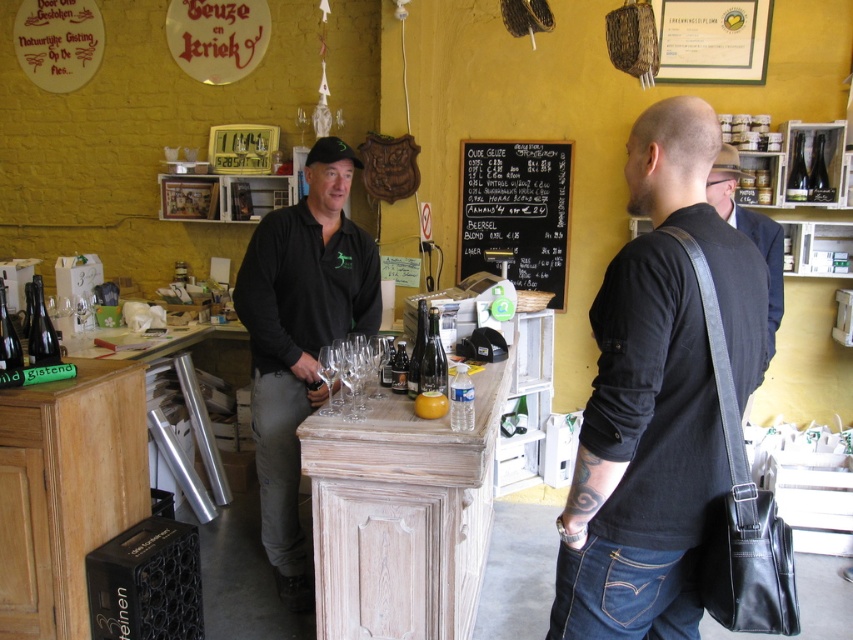
Question: Can you confirm if clear glass wine glass at center is smaller than translucent glass bottle at center?

Choices:
 (A) yes
 (B) no

Answer: (B)

Question: Which of the following is the farthest from the observer?

Choices:
 (A) clear glass wine glass at center
 (B) translucent glass bottle at center
 (C) green glass bottle at upper right

Answer: (C)

Question: Estimate the real-world distances between objects in this image. Which object is farther from the matte black bottle at left?

Choices:
 (A) black matte shirt at center
 (B) black chalkboard at upper center
 (C) green glass bottle at upper right

Answer: (C)

Question: Which point is farther to the camera?

Choices:
 (A) black chalkboard at upper center
 (B) black matte shirt at center
 (C) translucent glass bottle at center
 (D) dark blue suit at center

Answer: (A)

Question: In this image, where is dark blue suit at center located relative to matte black bottle at left?

Choices:
 (A) below
 (B) above

Answer: (B)

Question: Can you confirm if dark blue suit at center is bigger than clear glass wine glass at center?

Choices:
 (A) no
 (B) yes

Answer: (B)